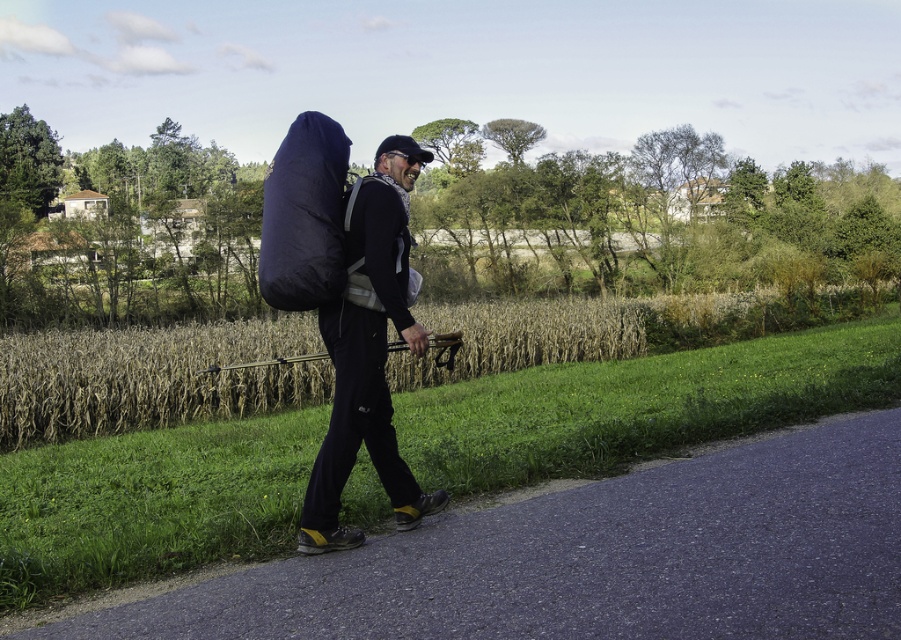
You are planning to place a 3.5 meter long tent between the matte black backpack at center and the navy blue fabric sleeping bag at upper center. Is there enough space for the tent?

The distance between the matte black backpack at center and the navy blue fabric sleeping bag at upper center is 3.40 meters. Since the tent is 3.5 meters long, there isn not enough space to place the tent between them.

You are a hiker who just started walking on the asphalt road at center. You have a matte black backpack at center. Where is your backpack located relative to the asphalt road?

→ The matte black backpack at center is positioned above the asphalt road at center.

You are a hiker who just arrived at the scene. You need to locate your matte black backpack at center. Where should you look based on the coordinates provided?

The matte black backpack at center is located at point coordinates of (369, 352).